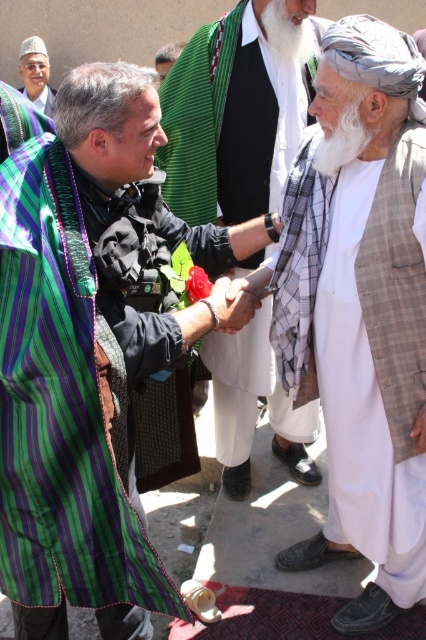
You are an anthropologist observing a cultural event and need to document the arrangement of traditional garments. Which object is positioned to the right of the other between the green striped cloth at center and the green striped robe at upper left?

The green striped cloth at center is positioned to the right of the green striped robe at upper left.

You are a photographer trying to capture the main subject wearing the white textured robe at center. Based on the coordinates provided, where should you position your camera to ensure the robe is centered in the frame?

The white textured robe at center is located at coordinates point (232,120), so positioning the camera to align with these coordinates will center the robe in the frame.